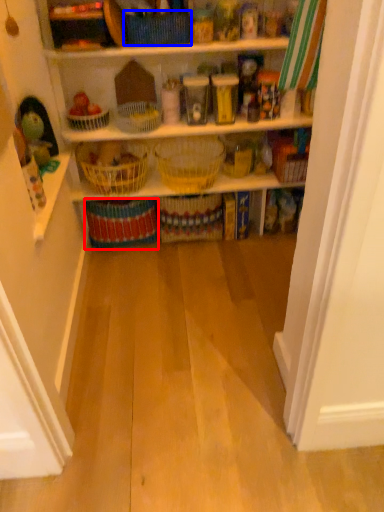
Question: Among these objects, which one is farthest to the camera, basket (highlighted by a red box) or basket (highlighted by a blue box)?

Choices:
 (A) basket
 (B) basket

Answer: (A)